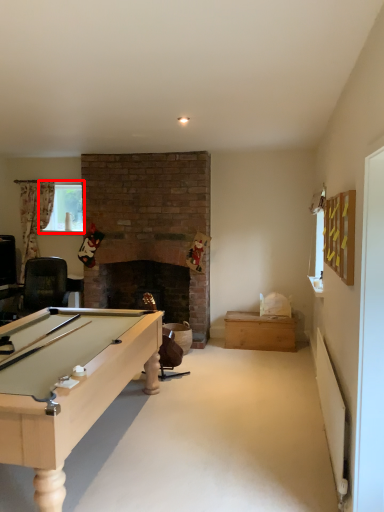
Question: Where is window screen (annotated by the red box) located in relation to drawer in the image?

Choices:
 (A) left
 (B) right

Answer: (A)